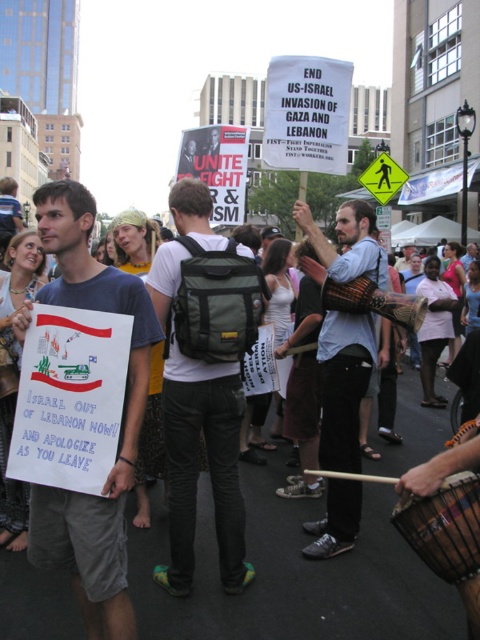
Question: Can you confirm if white paper sign at center is thinner than matte blue t-shirt at center?

Choices:
 (A) yes
 (B) no

Answer: (B)

Question: Can you confirm if white paper sign at center is smaller than green fabric backpack at center?

Choices:
 (A) yes
 (B) no

Answer: (B)

Question: Which is farther from the matte blue t-shirt at center?

Choices:
 (A) light blue shirt at center
 (B) white paper sign at center
 (C) dark brown wooden drum at lower right

Answer: (B)

Question: Which object is farther from the camera taking this photo?

Choices:
 (A) white paper sign at center
 (B) green fabric backpack at center
 (C) matte blue t-shirt at center

Answer: (B)

Question: Does light blue shirt at center come in front of dark brown wooden drum at lower right?

Choices:
 (A) yes
 (B) no

Answer: (B)

Question: Among these objects, which one is nearest to the camera?

Choices:
 (A) dark brown wooden drum at lower right
 (B) light blue shirt at center

Answer: (A)